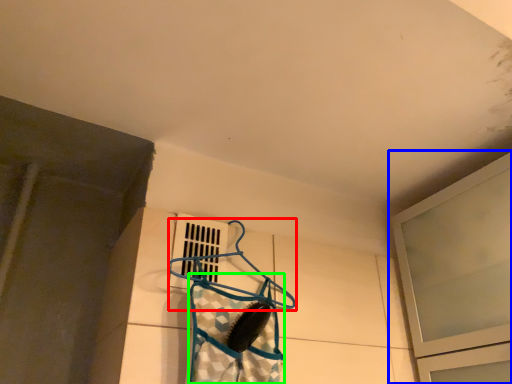
Question: Which is nearer to the hanger (highlighted by a red box)? window (highlighted by a blue box) or clothing (highlighted by a green box).

Choices:
 (A) window
 (B) clothing

Answer: (B)